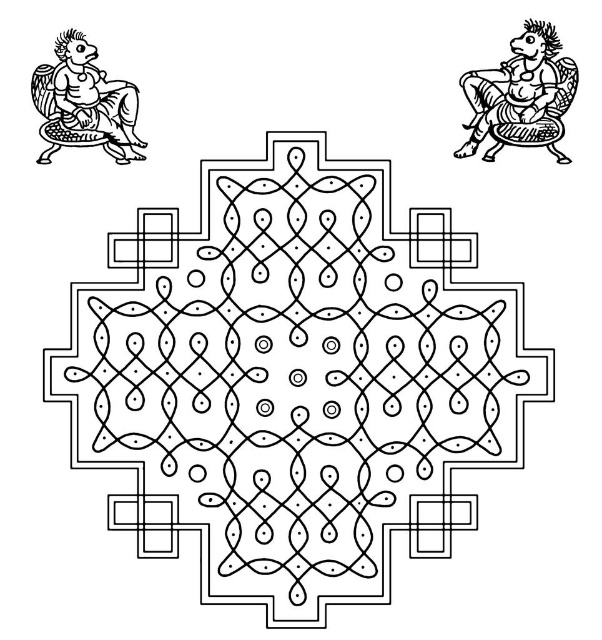
Measure the distance between black line art figure at upper right and black ink figure at upper left.

black line art figure at upper right and black ink figure at upper left are 24.01 inches apart.

Between black line art figure at upper right and black ink figure at upper left, which one has more height?

Standing taller between the two is black line art figure at upper right.

Describe the element at coordinates (521, 93) in the screenshot. Image resolution: width=602 pixels, height=640 pixels. I see `black line art figure at upper right` at that location.

The height and width of the screenshot is (640, 602). Identify the location of black line art figure at upper right. coord(521,93).

What do you see at coordinates (299, 365) in the screenshot? Image resolution: width=602 pixels, height=640 pixels. I see `black line art mandala at center` at bounding box center [299, 365].

Between black line art mandala at center and black ink figure at upper left, which one is positioned lower?

black line art mandala at center is lower down.

Which is in front, point (175, 460) or point (63, 125)?

Point (175, 460) is more forward.

Image resolution: width=602 pixels, height=640 pixels. I want to click on black line art mandala at center, so click(x=299, y=365).

Who is lower down, black line art mandala at center or black line art figure at upper right?

Positioned lower is black line art mandala at center.

Is black line art mandala at center further to the viewer compared to black line art figure at upper right?

No, it is in front of black line art figure at upper right.

Where is `black line art mandala at center`? The height and width of the screenshot is (640, 602). black line art mandala at center is located at coordinates coord(299,365).